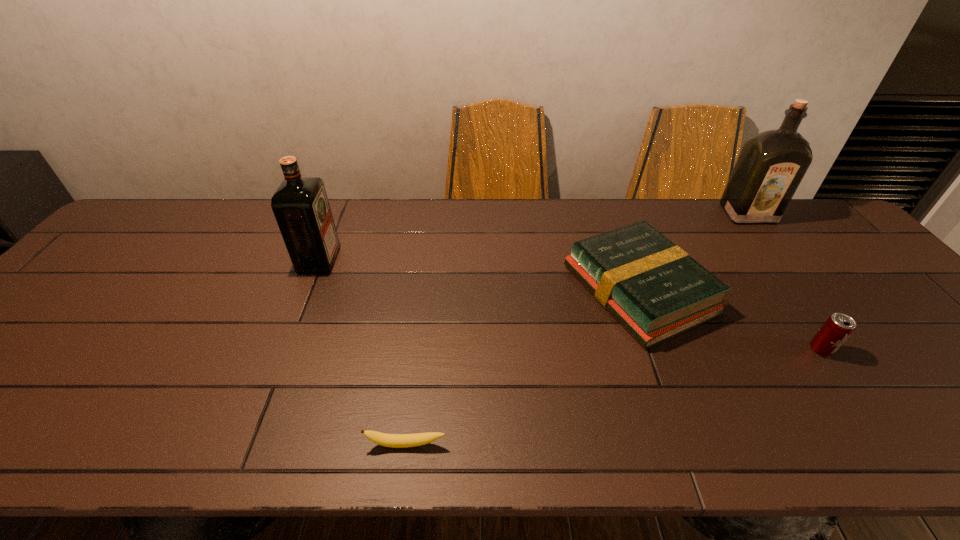
You are a GUI agent. You are given a task and a screenshot of the screen. Output one action in this format:
    pyautogui.click(x=<x>, y=<y>)
    Task: Click on the blank area located on the back of the beer can
    The height and width of the screenshot is (540, 960).
    Given the screenshot: What is the action you would take?
    pyautogui.click(x=768, y=275)

Identify the location of free space located 0.100m on the front of the third object from right to left. The image size is (960, 540). (x=676, y=388).

Where is `liquor that is at the far edge`? Image resolution: width=960 pixels, height=540 pixels. liquor that is at the far edge is located at coordinates (771, 165).

At what (x,y) coordinates should I click in order to perform the action: click on hardback book situated at the far edge. Please return your answer as a coordinate pair (x, y). This screenshot has height=540, width=960. Looking at the image, I should click on pyautogui.click(x=653, y=288).

Image resolution: width=960 pixels, height=540 pixels. In order to click on object at the near edge in this screenshot , I will do `click(388, 440)`.

The image size is (960, 540). I want to click on object that is positioned at the right edge, so click(771, 165).

At what (x,y) coordinates should I click in order to perform the action: click on object located at the far right corner. Please return your answer as a coordinate pair (x, y). The image size is (960, 540). Looking at the image, I should click on (771, 165).

The width and height of the screenshot is (960, 540). What are the coordinates of `vacant position at the far edge of the desktop` in the screenshot? It's located at (540, 238).

Find the location of `vacant space at the near edge of the desktop`. vacant space at the near edge of the desktop is located at coordinates (925, 443).

In the image, there is a desktop. Identify the location of vacant space at the left edge. The width and height of the screenshot is (960, 540). (59, 332).